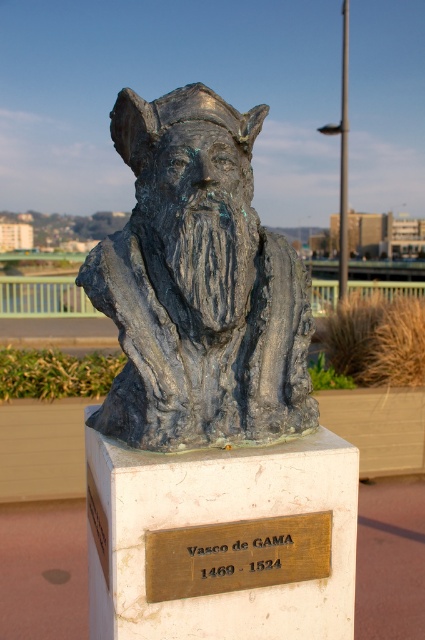
Question: Among these points, which one is farthest from the camera?

Choices:
 (A) (221, 586)
 (B) (163, 294)

Answer: (B)

Question: Among these points, which one is nearest to the camera?

Choices:
 (A) (260, 577)
 (B) (133, 392)

Answer: (A)

Question: Is bronze bust at center below gold-bronze plaque at center?

Choices:
 (A) no
 (B) yes

Answer: (A)

Question: Which object is farther from the camera taking this photo?

Choices:
 (A) gold-bronze plaque at center
 (B) bronze bust at center

Answer: (B)

Question: Is bronze bust at center in front of gold-bronze plaque at center?

Choices:
 (A) yes
 (B) no

Answer: (B)

Question: Does bronze bust at center appear on the right side of gold-bronze plaque at center?

Choices:
 (A) yes
 (B) no

Answer: (B)